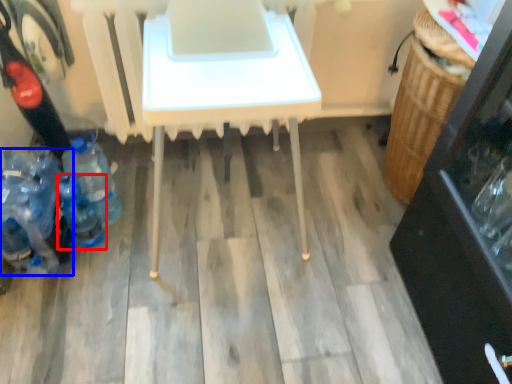
Question: Which object appears farthest to the camera in this image, bottle (highlighted by a red box) or bottle (highlighted by a blue box)?

Choices:
 (A) bottle
 (B) bottle

Answer: (A)